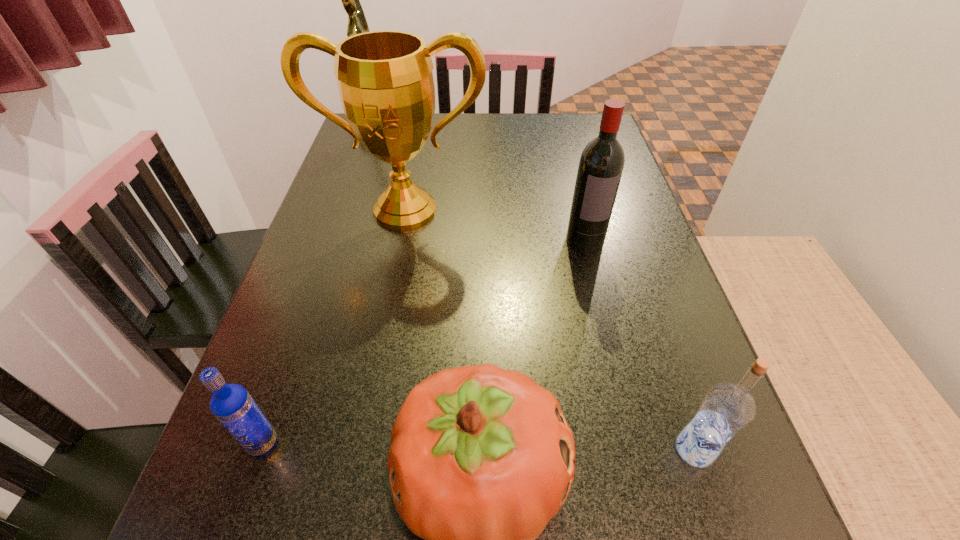
In the image, there is a desktop. Where is `free region at the far right corner`? The width and height of the screenshot is (960, 540). free region at the far right corner is located at coordinates (574, 136).

At what (x,y) coordinates should I click in order to perform the action: click on vacant area between the wine bottle and the right vodka. Please return your answer as a coordinate pair (x, y). Looking at the image, I should click on (639, 345).

Identify the location of free point between the nearer award and the shorter vodka. Image resolution: width=960 pixels, height=540 pixels. (334, 327).

The height and width of the screenshot is (540, 960). I want to click on unoccupied area between the farther award and the taller vodka, so click(x=533, y=289).

Identify the location of unoccupied position between the nearer award and the left vodka. (334, 327).

Locate an element on the screen. This screenshot has height=540, width=960. object that is the fourth closest to the nearer award is located at coordinates (231, 404).

Locate an element on the screen. the fifth closest object to the farther award is located at coordinates (727, 408).

The width and height of the screenshot is (960, 540). In order to click on free space that satisfies the following two spatial constraints: 1. on the front-facing side of the left vodka; 2. on the left side of the farther award in this screenshot , I will do `click(261, 443)`.

The width and height of the screenshot is (960, 540). Identify the location of vacant point that satisfies the following two spatial constraints: 1. on the back side of the shorter vodka; 2. on the front-facing side of the farther award. (372, 130).